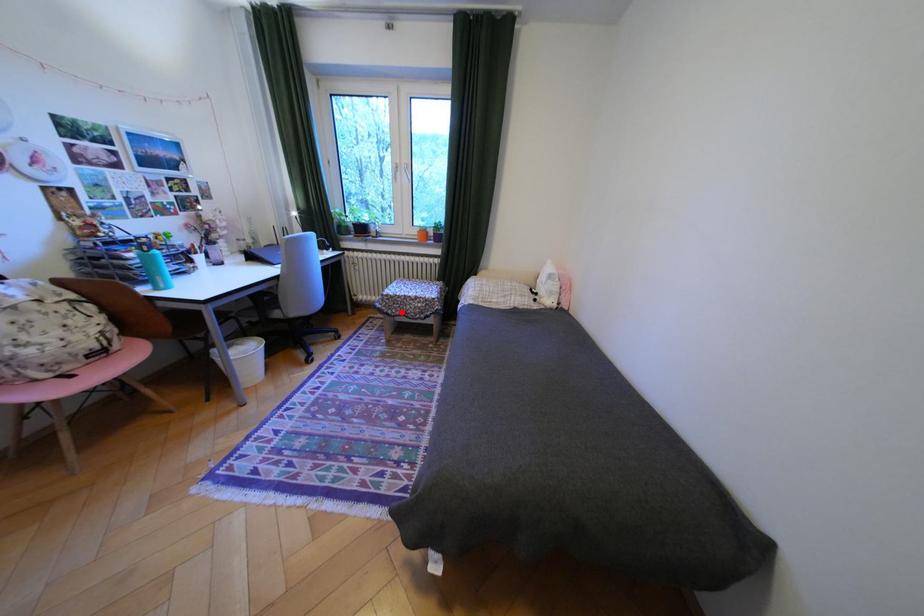
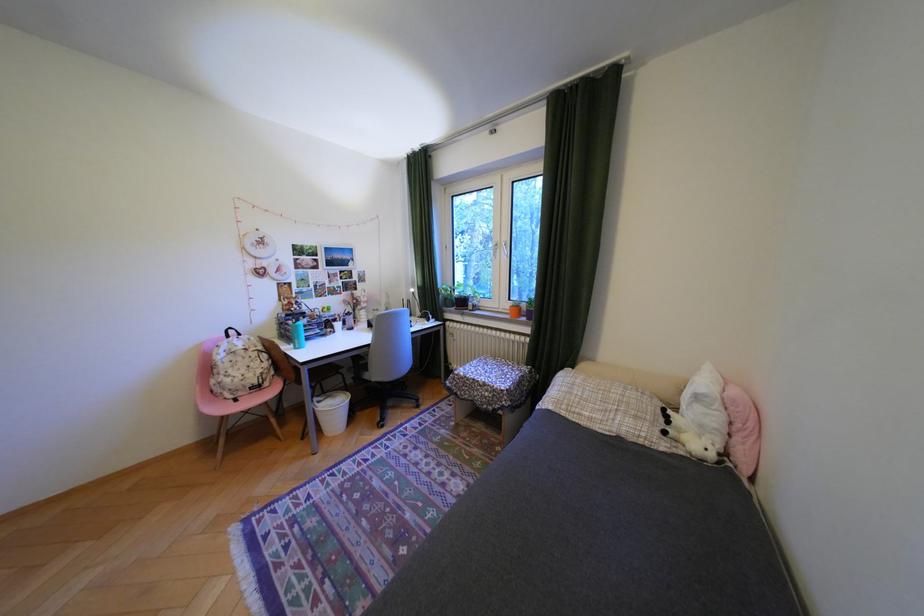
Question: I am providing you with two images of the same scene from different viewpoints. Given a red point in image1, look at the same physical point in image2. Is it:

Choices:
 (A) Closer to the viewpoint
 (B) Farther from the viewpoint

Answer: (B)